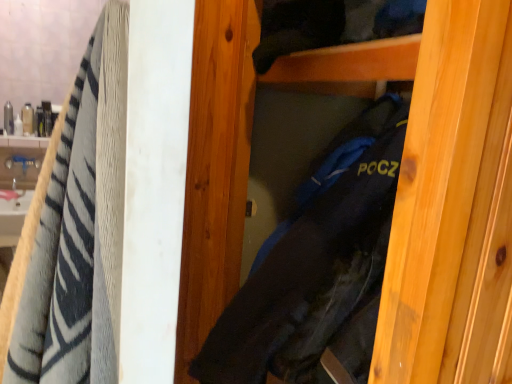
Measure the distance between point (493, 263) and camera.

The depth of point (493, 263) is 48.50 centimeters.

What do you see at coordinates (17, 189) in the screenshot?
I see `white glossy sink at left` at bounding box center [17, 189].

Locate an element on the screen. black fabric bag at center is located at coordinates (441, 189).

From the picture: Does black fabric bag at center turn towards white glossy sink at left?

No, black fabric bag at center is not turned towards white glossy sink at left.

Looking at this image, what's the angular difference between black fabric bag at center and white glossy sink at left's facing directions?

black fabric bag at center and white glossy sink at left are facing 92.4 degrees away from each other.

Which is farther, (376, 339) or (21, 177)?

The point (21, 177) is farther.

Relative to white glossy sink at left, is black fabric bag at center in front or behind?

black fabric bag at center is in front of white glossy sink at left.

From the picture: From a real-world perspective, who is located lower, soft cotton towel at left or white glossy sink at left?

In real-world perspective, white glossy sink at left is lower.

Find the location of a particular element. towel that appears on the right of white glossy sink at left is located at coordinates (78, 230).

In terms of size, does soft cotton towel at left appear bigger or smaller than white glossy sink at left?

soft cotton towel at left is bigger than white glossy sink at left.

How far apart are black fabric bag at center and soft cotton towel at left?

black fabric bag at center and soft cotton towel at left are 15.96 inches apart from each other.

Consider the image. Relative to soft cotton towel at left, is black fabric bag at center in front or behind?

black fabric bag at center is in front of soft cotton towel at left.

Between black fabric bag at center and soft cotton towel at left, which one has larger size?

black fabric bag at center.

In the image, there is a black fabric bag at center. At what (x,y) coordinates should I click in order to perform the action: click on towel below it (from the image's perspective). Please return your answer as a coordinate pair (x, y). Looking at the image, I should click on (78, 230).

Is white glossy sink at left situated inside soft cotton towel at left or outside?

white glossy sink at left is spatially situated outside soft cotton towel at left.

From a real-world perspective, which is physically above, white glossy sink at left or soft cotton towel at left?

soft cotton towel at left.

Is white glossy sink at left turned away from soft cotton towel at left?

No, soft cotton towel at left is not at the back of white glossy sink at left.

From the image's perspective, which is below, white glossy sink at left or soft cotton towel at left?

soft cotton towel at left.

Is white glossy sink at left facing towards black fabric bag at center?

No, white glossy sink at left is not turned towards black fabric bag at center.

Looking at their sizes, would you say white glossy sink at left is wider or thinner than black fabric bag at center?

Clearly, white glossy sink at left has less width compared to black fabric bag at center.

Is white glossy sink at left placed right next to black fabric bag at center?

No, white glossy sink at left is not beside black fabric bag at center.

Locate an element on the screen. This screenshot has height=384, width=512. door on the right of white glossy sink at left is located at coordinates (441, 189).

Is soft cotton towel at left at the left side of black fabric bag at center?

Correct, you'll find soft cotton towel at left to the left of black fabric bag at center.

Can you confirm if soft cotton towel at left is taller than black fabric bag at center?

No, soft cotton towel at left is not taller than black fabric bag at center.

Would you say soft cotton towel at left contains black fabric bag at center?

No, soft cotton towel at left does not contain black fabric bag at center.

From the image's perspective, which is below, soft cotton towel at left or black fabric bag at center?

soft cotton towel at left is shown below in the image.

This screenshot has width=512, height=384. Identify the location of sink below the black fabric bag at center (from a real-world perspective). [17, 189].

Image resolution: width=512 pixels, height=384 pixels. I want to click on towel that is above the white glossy sink at left (from a real-world perspective), so click(78, 230).

Considering their positions, is white glossy sink at left positioned further to soft cotton towel at left than black fabric bag at center?

white glossy sink at left is further to soft cotton towel at left.

Which object lies further to the anchor point white glossy sink at left, soft cotton towel at left or black fabric bag at center?

Based on the image, soft cotton towel at left appears to be further to white glossy sink at left.

Considering their positions, is soft cotton towel at left positioned closer to black fabric bag at center than white glossy sink at left?

Based on the image, soft cotton towel at left appears to be nearer to black fabric bag at center.

From the image, which object appears to be farther from black fabric bag at center, white glossy sink at left or soft cotton towel at left?

The object further to black fabric bag at center is white glossy sink at left.

Considering their positions, is black fabric bag at center positioned closer to soft cotton towel at left than white glossy sink at left?

black fabric bag at center lies closer to soft cotton towel at left than the other object.

Based on their spatial positions, is black fabric bag at center or soft cotton towel at left closer to white glossy sink at left?

The object closer to white glossy sink at left is black fabric bag at center.

This screenshot has height=384, width=512. Identify the location of towel between black fabric bag at center and white glossy sink at left from front to back. [78, 230].